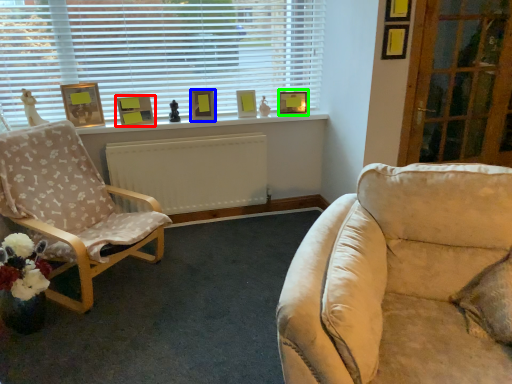
Question: Which object is positioned closest to picture frame (highlighted by a red box)? Select from picture frame (highlighted by a blue box) and picture frame (highlighted by a green box).

Choices:
 (A) picture frame
 (B) picture frame

Answer: (A)